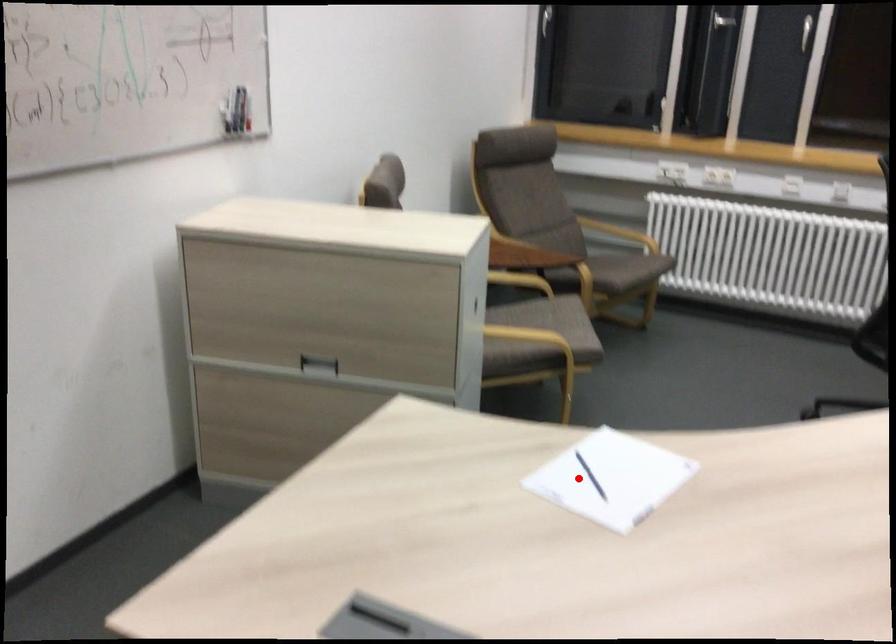
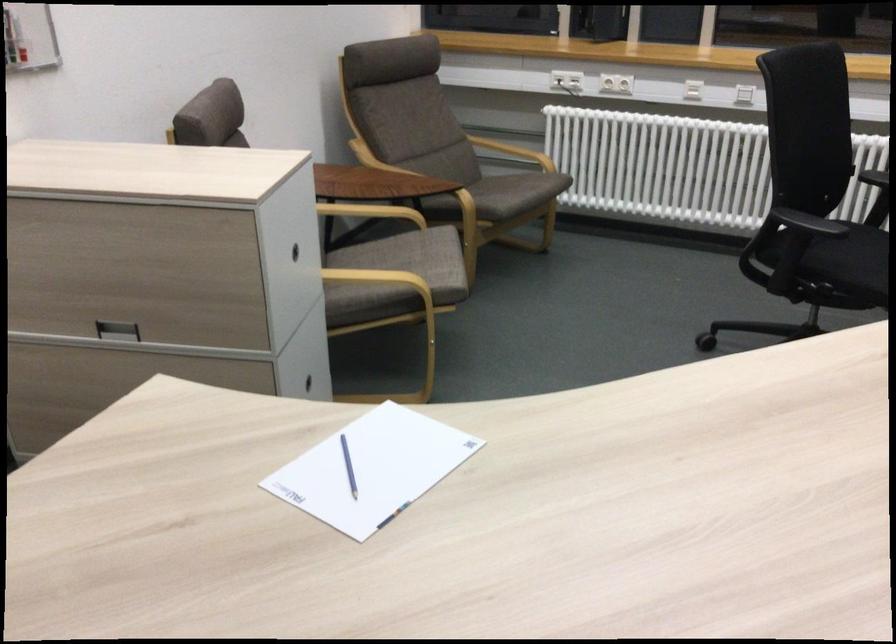
Question: I am providing you with two images of the same scene from different viewpoints. In image1, a red point is highlighted. Considering the same 3D point in image2, which of the following is correct?

Choices:
 (A) It is closer
 (B) It is farther

Answer: (A)